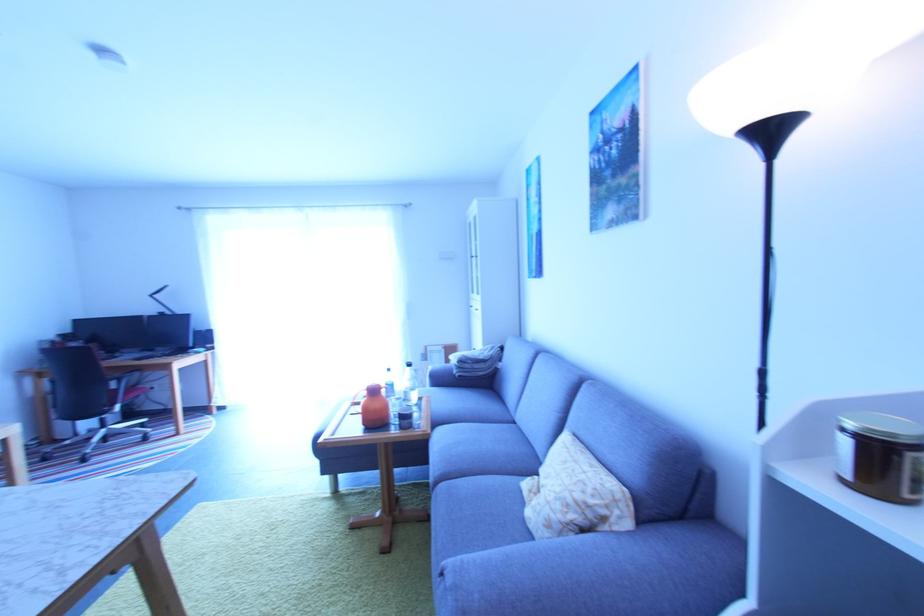
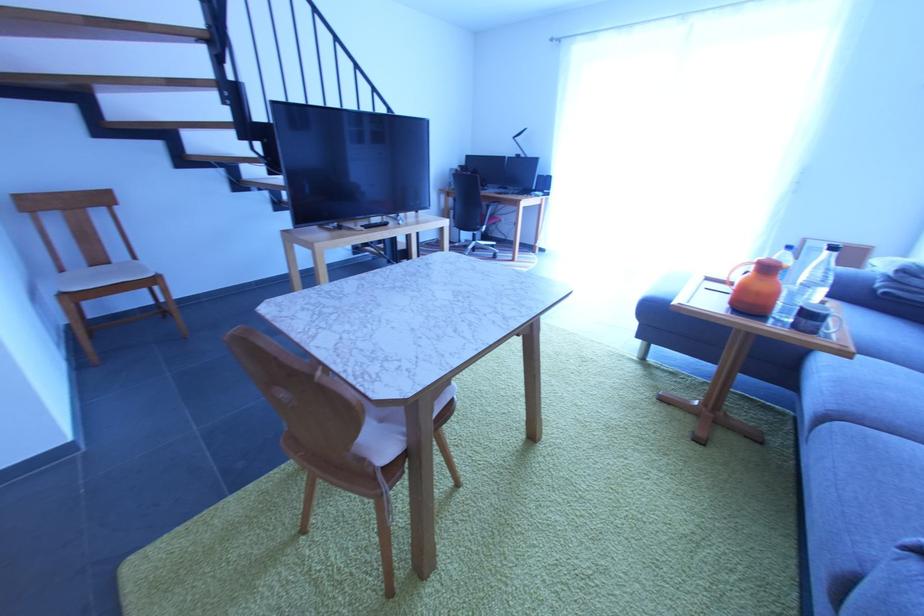
In the second image, find the point that corresponds to point (440, 485) in the first image.

(833, 419)